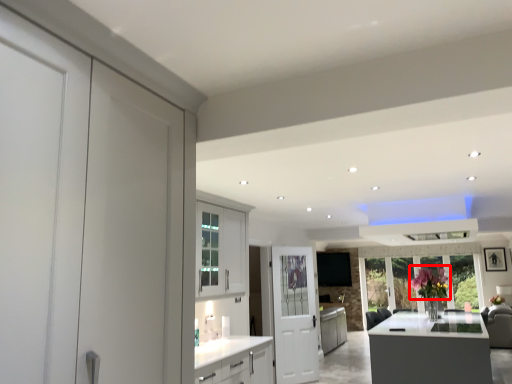
Question: From the image's perspective, considering the relative positions of flower (annotated by the red box) and door in the image provided, where is flower (annotated by the red box) located with respect to the staircase?

Choices:
 (A) below
 (B) above

Answer: (B)